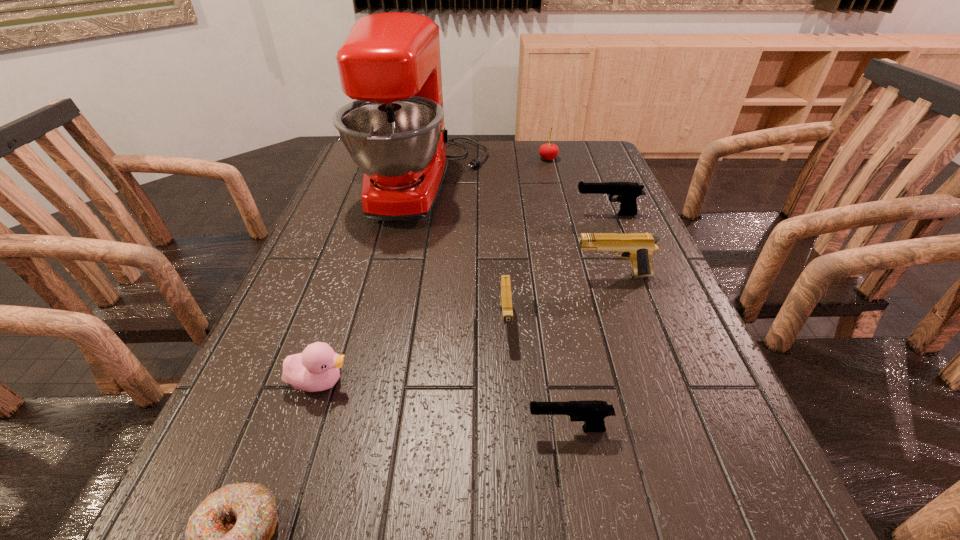
Identify the location of kitchen mixer. (x=390, y=63).

Identify the location of red kitchen mixer. (390, 63).

The width and height of the screenshot is (960, 540). Find the location of `cherry`. cherry is located at coordinates (549, 151).

Where is `the right tan pistol`? the right tan pistol is located at coordinates (638, 247).

Where is `the farther tan pistol`? The width and height of the screenshot is (960, 540). the farther tan pistol is located at coordinates (638, 247).

Locate an element on the screen. the bigger black pistol is located at coordinates (627, 192).

The width and height of the screenshot is (960, 540). I want to click on the farther black pistol, so click(627, 192).

Where is `the sixth farthest object`? The image size is (960, 540). the sixth farthest object is located at coordinates (315, 369).

The width and height of the screenshot is (960, 540). What are the coordinates of `duckling` in the screenshot? It's located at 315,369.

Find the location of `the nearer tan pistol`. the nearer tan pistol is located at coordinates tap(505, 294).